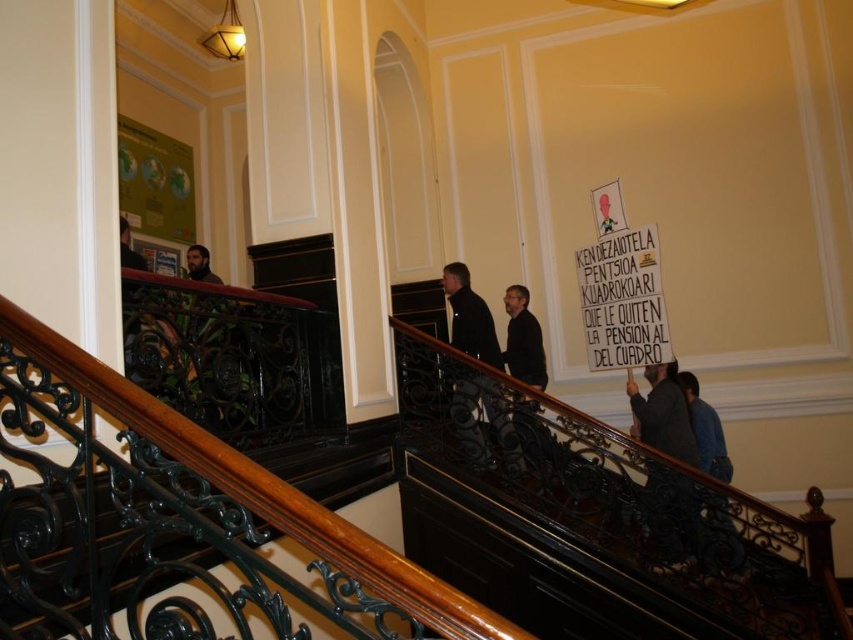
Who is taller, black wrought iron at center or blue denim jeans at lower right?

With more height is black wrought iron at center.

Is point (70, 516) positioned behind point (704, 451)?

That is False.

Which is in front, point (24, 548) or point (730, 532)?

Positioned in front is point (24, 548).

This screenshot has width=853, height=640. Identify the location of black wrought iron at center. (173, 534).

Is black wrought iron at center to the right of dark gray fabric jacket at lower right from the viewer's perspective?

No, black wrought iron at center is not to the right of dark gray fabric jacket at lower right.

Is point (358, 465) less distant than point (688, 416)?

Yes, it is.

This screenshot has height=640, width=853. Find the location of `black wrought iron at center`. black wrought iron at center is located at coordinates (173, 534).

Where is `dark gray fabric jacket at lower right`? Image resolution: width=853 pixels, height=640 pixels. dark gray fabric jacket at lower right is located at coordinates (662, 413).

Between dark gray fabric jacket at lower right and blue denim jeans at lower right, which one has less height?

blue denim jeans at lower right

The height and width of the screenshot is (640, 853). Identify the location of dark gray fabric jacket at lower right. (662, 413).

Identify the location of dark gray fabric jacket at lower right. Image resolution: width=853 pixels, height=640 pixels. (662, 413).